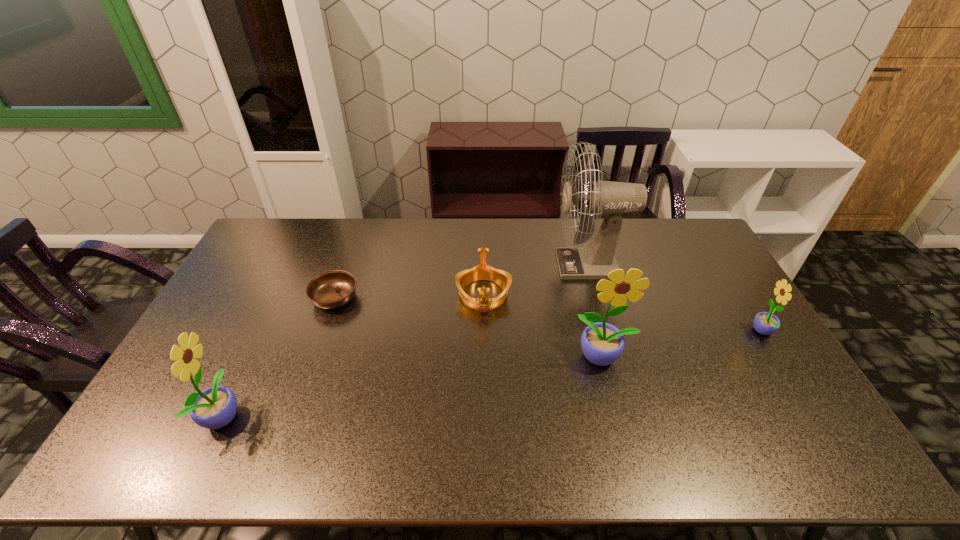
Locate an element on the screen. free region located on the front-facing side of the fourth shortest object is located at coordinates (278, 415).

Locate an element on the screen. vacant region located on the front-facing side of the second sunflower from right to left is located at coordinates (612, 393).

You are a GUI agent. You are given a task and a screenshot of the screen. Output one action in this format:
    pyautogui.click(x=<x>, y=<y>)
    Task: Click on the free space located on the front-facing side of the rightmost object
    The image size is (960, 540).
    Given the screenshot: What is the action you would take?
    pyautogui.click(x=735, y=332)

This screenshot has height=540, width=960. Find the location of `vacant region located on the front-facing side of the rightmost object`. vacant region located on the front-facing side of the rightmost object is located at coordinates (699, 332).

Find the location of a particular element. vacant space located on the front-facing side of the rightmost object is located at coordinates [x=662, y=332].

Identify the location of vacant space situated 0.340m on the air flow direction of the tallest object. The height and width of the screenshot is (540, 960). (460, 265).

Locate an element on the screen. The image size is (960, 540). free space located 0.150m on the air flow direction of the tallest object is located at coordinates (514, 265).

This screenshot has width=960, height=540. Identify the location of vacant space located 0.290m on the air flow direction of the tallest object. click(x=474, y=265).

I want to click on blank area located on the back of the shortest object, so click(x=351, y=251).

Find the location of a particular element. vacant area located 0.280m at the front emblem of the tiara is located at coordinates (484, 399).